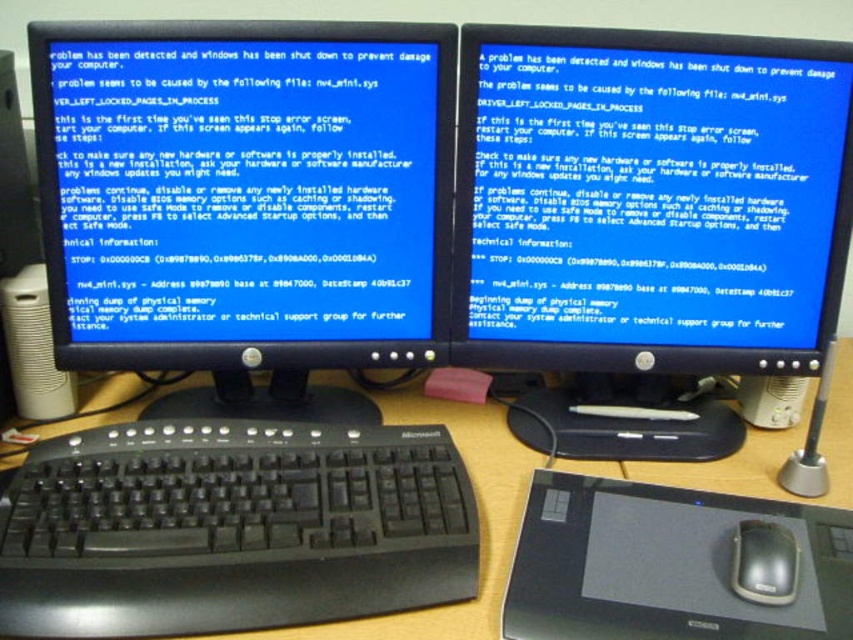
You are setting up a new wireless mouse and need to place it on the wooden desk at center. The mouse requires a flat surface area of 15x15 cm. Considering the current objects on the desk, can the black matte mouse at lower right be moved to accommodate the new mouse?

The wooden desk at center is larger in size than the black matte mouse at lower right. Therefore, there is sufficient space on the wooden desk at center to move the existing black matte mouse at lower right and place the new mouse, as the desk has more space than the current mouse occupies.

You are a technician trying to assess the workspace layout. Where is the wooden desk at center located in terms of coordinates?

The wooden desk at center is located at coordinates point (480, 513).

In the scene shown: You are a technician trying to fix two broken monitors. You have a tool that can only reach 70 centimeters. The two points where the monitors are located are marked as point (90, 438). Can you use your tool to fix both monitors at the same time?

The distance between the two points where the monitors are located is 80.13 centimeters. Since your tool can only reach 70 centimeters, you cannot use it to fix both monitors simultaneously.